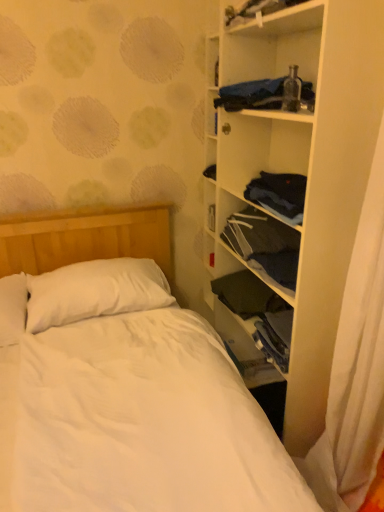
Question: Is white matte shelf at right wider or thinner than dark blue fabric at center-right, positioned as the first clothing in bottom-to-top order?

Choices:
 (A) wide
 (B) thin

Answer: (B)

Question: Does point (211, 73) appear closer or farther from the camera than point (251, 283)?

Choices:
 (A) farther
 (B) closer

Answer: (B)

Question: Considering the real-world distances, which object is farthest from the blue fabric at upper right, which is counted as the third clothing, starting from the bottom?

Choices:
 (A) dark blue fabric at center-right, positioned as the first clothing in bottom-to-top order
 (B) white soft pillow at upper left
 (C) white matte shelf at right
 (D) dark blue fabric at center right, the 2th clothing when ordered from bottom to top

Answer: (B)

Question: Which object is positioned farthest from the white soft pillow at upper left?

Choices:
 (A) white matte shelf at right
 (B) dark blue fabric at center right, positioned as the second clothing in top-to-bottom order
 (C) blue fabric at upper right, which is the 1th clothing from top to bottom
 (D) dark blue fabric at center-right, which is counted as the 3th clothing, starting from the top

Answer: (C)